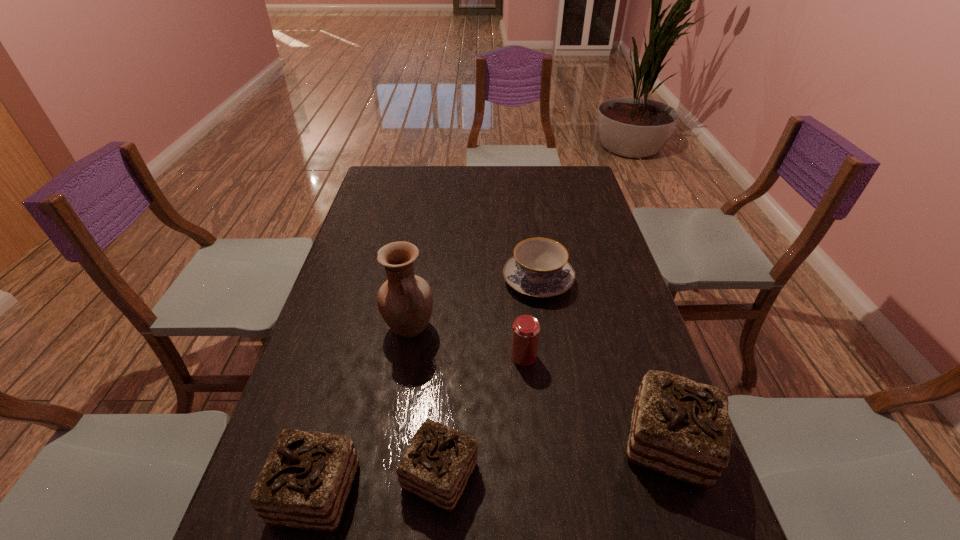
At what (x,y) coordinates should I click in order to perform the action: click on vacant space located 0.080m on the right of the beer can. Please return your answer as a coordinate pair (x, y). Looking at the image, I should click on (567, 356).

I want to click on vacant space located 0.120m with the handle on the side of the chinaware, so click(x=532, y=236).

What are the coordinates of `vacant space located 0.320m with the handle on the side of the chinaware` in the screenshot? It's located at (527, 205).

The width and height of the screenshot is (960, 540). Find the location of `blank space located with the handle on the side of the chinaware`. blank space located with the handle on the side of the chinaware is located at coordinates (526, 198).

Find the location of `object that is at the left edge`. object that is at the left edge is located at coordinates pos(305,483).

Where is `chocolate cake that is at the right edge`? The image size is (960, 540). chocolate cake that is at the right edge is located at coordinates (680, 428).

What are the coordinates of `chinaware at the right edge` in the screenshot? It's located at (539, 268).

The width and height of the screenshot is (960, 540). Identify the location of object that is positioned at the near left corner. (305, 483).

The height and width of the screenshot is (540, 960). Find the location of `object situated at the near right corner`. object situated at the near right corner is located at coordinates pyautogui.click(x=680, y=428).

This screenshot has height=540, width=960. I want to click on vacant space at the far edge of the desktop, so click(539, 166).